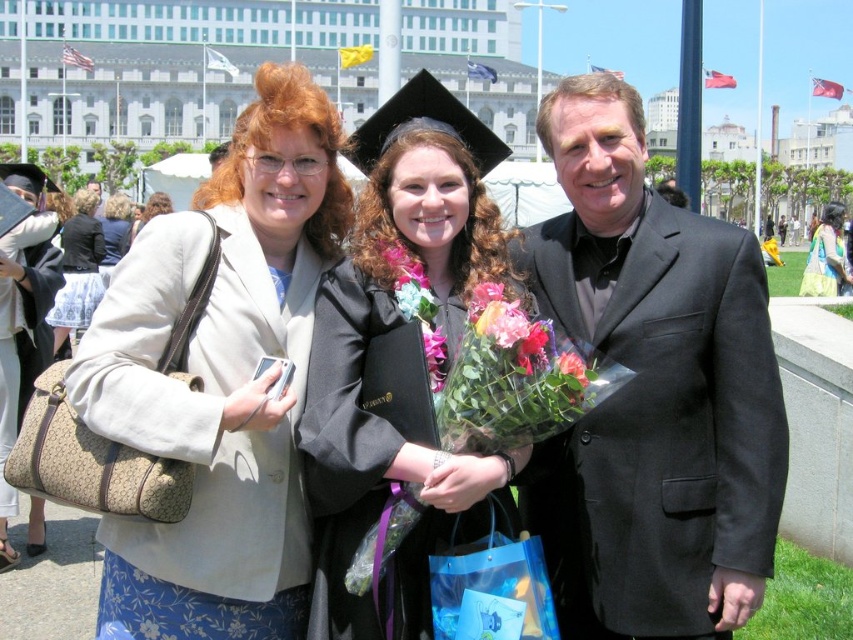
Does matte black graduation gown at center lie in front of floral lei at center?

That is True.

Is point (334, 614) farther from viewer compared to point (409, 320)?

No, it is not.

Where is `matte black graduation gown at center`? matte black graduation gown at center is located at coordinates (398, 385).

Can you confirm if light beige fabric purse at left is smaller than green floral dress at center?

Correct, light beige fabric purse at left occupies less space than green floral dress at center.

Can you confirm if light beige fabric purse at left is positioned below green floral dress at center?

Indeed, light beige fabric purse at left is positioned under green floral dress at center.

Does point (79, 307) lie behind point (824, 209)?

No.

Image resolution: width=853 pixels, height=640 pixels. I want to click on light beige fabric purse at left, so click(78, 269).

Does vibrant floral bouquet at center have a greater width compared to light beige fabric purse at left?

Yes, vibrant floral bouquet at center is wider than light beige fabric purse at left.

Consider the image. Between vibrant floral bouquet at center and light beige fabric purse at left, which one has less height?

Standing shorter between the two is vibrant floral bouquet at center.

What are the coordinates of `vibrant floral bouquet at center` in the screenshot? It's located at (508, 380).

Image resolution: width=853 pixels, height=640 pixels. Identify the location of vibrant floral bouquet at center. (508, 380).